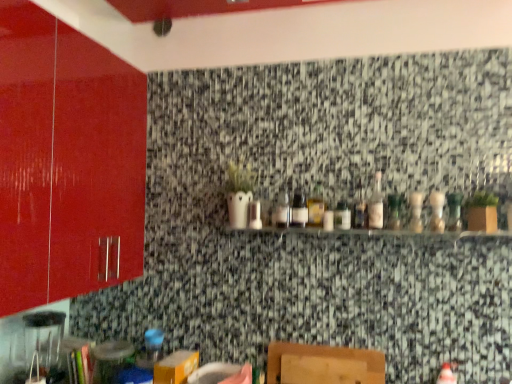
Question: In the image, is clear glass bottle at center, the 5th bottle when ordered from right to left, positioned in front of or behind clear glass bottle at center, which appears as the seventh bottle when viewed from the right?

Choices:
 (A) behind
 (B) front

Answer: (B)

Question: In terms of width, does clear glass bottle at center, the 5th bottle when ordered from right to left, look wider or thinner when compared to clear glass bottle at center, which appears as the seventh bottle when viewed from the right?

Choices:
 (A) wide
 (B) thin

Answer: (B)

Question: Which object is the closest to the translucent glass bottle at center, which is the ninth bottle in right-to-left order?

Choices:
 (A) translucent glass bottle at center, acting as the 7th bottle starting from the left
 (B) clear glass bottle at center, which appears as the seventh bottle when viewed from the right
 (C) clear glass bottle at center, which appears as the 8th bottle when viewed from the left
 (D) clear glass bottle at center, the 5th bottle when ordered from right to left
 (E) wooden cutting board at center

Answer: (B)

Question: Which of these objects is positioned farthest from the clear glass bottle at center, which appears as the 8th bottle when viewed from the left?

Choices:
 (A) clear glass bottle at right, the 9th bottle from the left
 (B) green glass bottle at center, arranged as the 4th bottle when viewed from the right
 (C) clear glass shelf at center
 (D) translucent glass bottle at center, the 2th bottle when ordered from left to right
 (E) clear glass bottle at center, which appears as the seventh bottle when viewed from the right

Answer: (D)